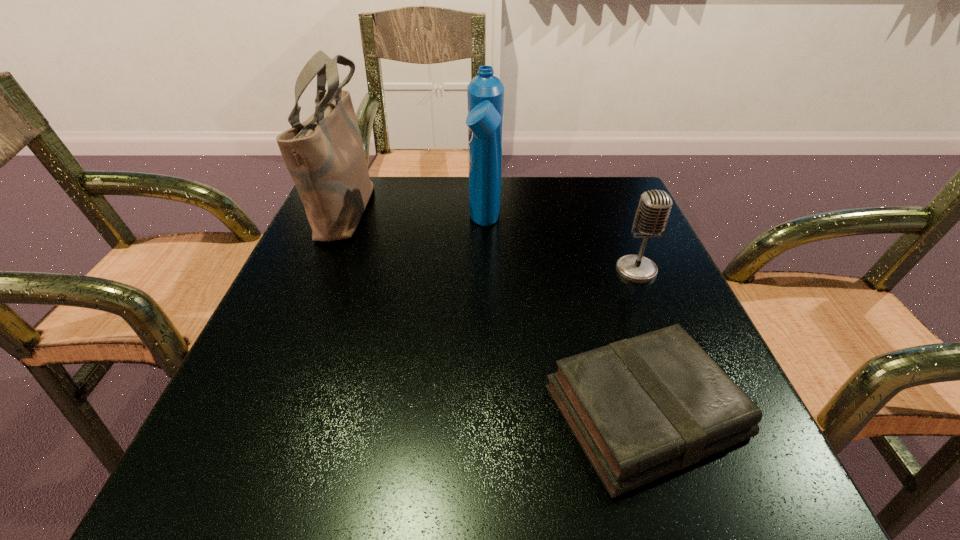
I want to click on object that ranks as the third closest to the leftmost object, so click(654, 208).

Select which object is the third closest to the shampoo. Please provide its 2D coordinates. Your answer should be formatted as a tuple, i.e. [(x, y)], where the tuple contains the x and y coordinates of a point satisfying the conditions above.

[(640, 408)]

I want to click on free space in the image that satisfies the following two spatial constraints: 1. on the front-facing side of the shoulder bag; 2. on the back side of the third farthest object, so pyautogui.click(x=321, y=270).

At what (x,y) coordinates should I click in order to perform the action: click on free space that satisfies the following two spatial constraints: 1. on the front-facing side of the shoulder bag; 2. on the left side of the book. Please return your answer as a coordinate pair (x, y). The image size is (960, 540). Looking at the image, I should click on (261, 411).

You are a GUI agent. You are given a task and a screenshot of the screen. Output one action in this format:
    pyautogui.click(x=<x>, y=<y>)
    Task: Click on the vacant region that satisfies the following two spatial constraints: 1. on the front-facing side of the second shortest object; 2. on the right side of the shoulder bag
    
    Given the screenshot: What is the action you would take?
    pyautogui.click(x=321, y=270)

Find the location of a particular element. This screenshot has height=540, width=960. free location that satisfies the following two spatial constraints: 1. on the front-facing side of the second shortest object; 2. on the right side of the shoulder bag is located at coordinates (321, 270).

Find the location of `vacant space that satisfies the following two spatial constraints: 1. on the front-facing side of the third farthest object; 2. on the right side of the leftmost object`. vacant space that satisfies the following two spatial constraints: 1. on the front-facing side of the third farthest object; 2. on the right side of the leftmost object is located at coordinates (321, 270).

Locate an element on the screen. free space that satisfies the following two spatial constraints: 1. on the front-facing side of the leftmost object; 2. on the right side of the third tallest object is located at coordinates pyautogui.click(x=321, y=270).